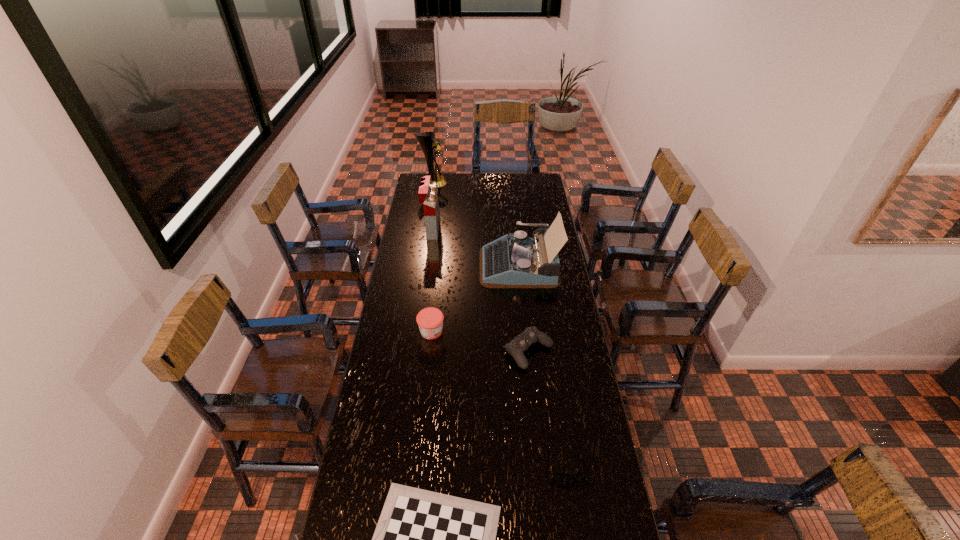
I want to click on object that is the third closest to the sixth tallest object, so click(x=430, y=320).

Locate an element on the screen. This screenshot has height=540, width=960. free region that satisfies the following two spatial constraints: 1. with the lid open on the control; 2. on the right side of the second farthest object is located at coordinates (415, 352).